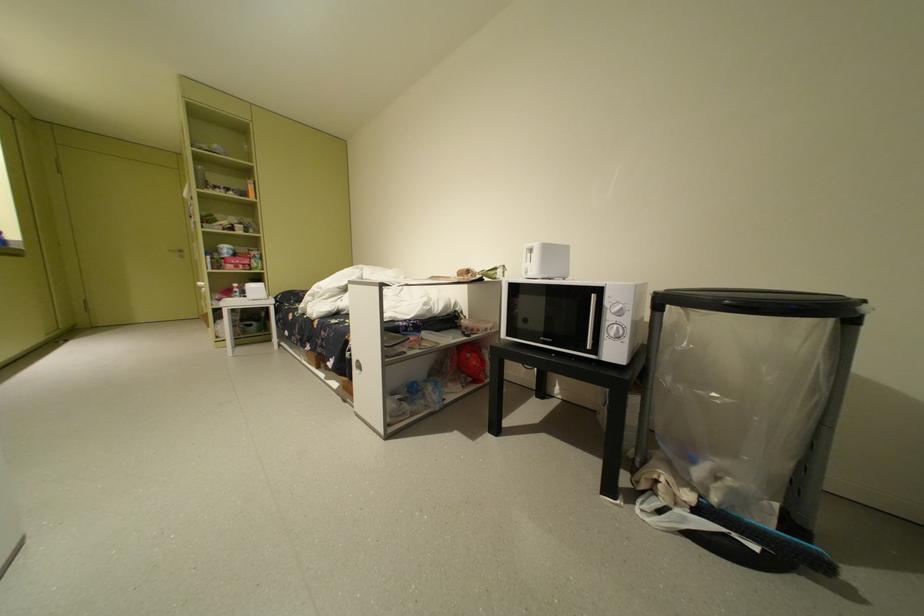
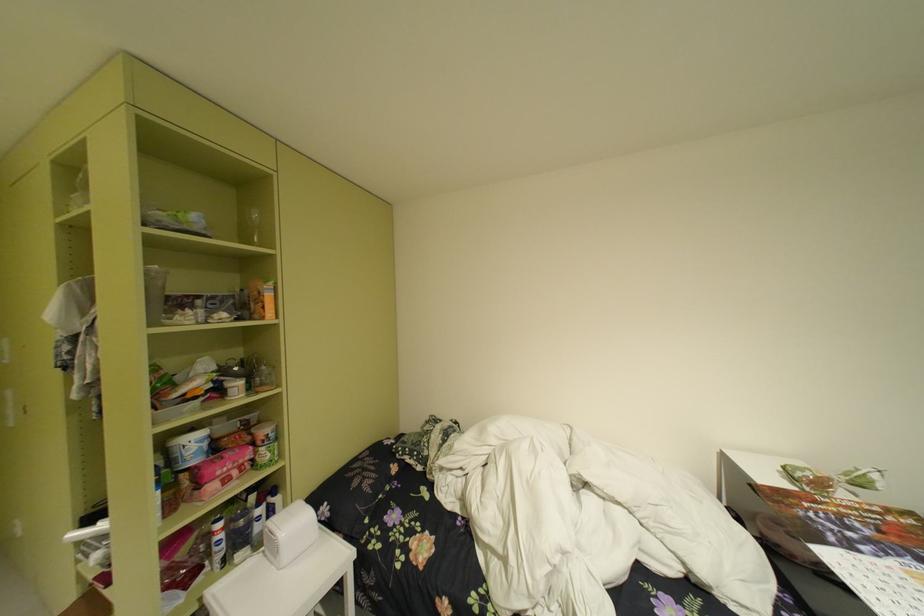
In the second image, find the point that corresponds to point 249,288 in the first image.

(235, 528)